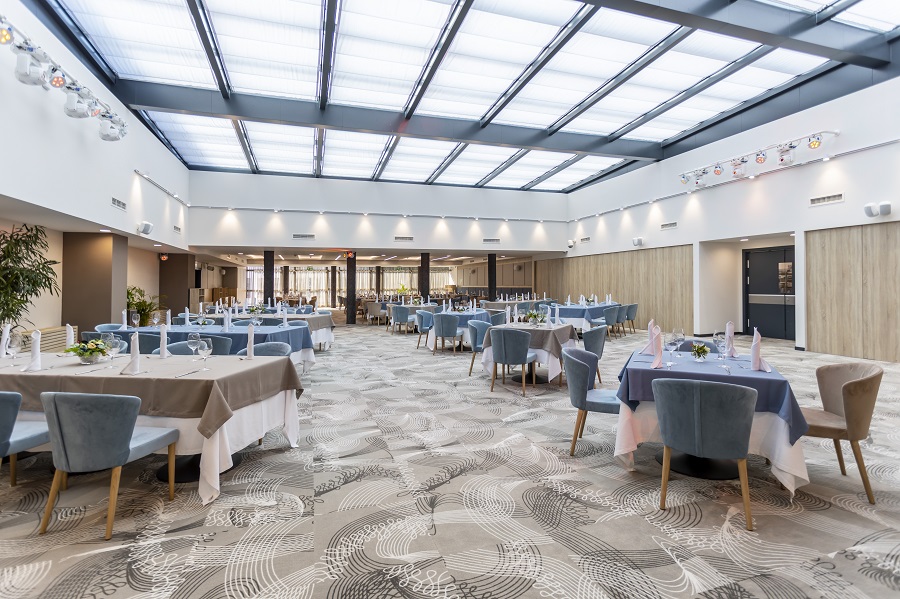
This screenshot has height=599, width=900. I want to click on tables in room, so pyautogui.click(x=186, y=384), pyautogui.click(x=284, y=332), pyautogui.click(x=320, y=320), pyautogui.click(x=407, y=302), pyautogui.click(x=464, y=304), pyautogui.click(x=524, y=295), pyautogui.click(x=590, y=302), pyautogui.click(x=545, y=326), pyautogui.click(x=672, y=361).